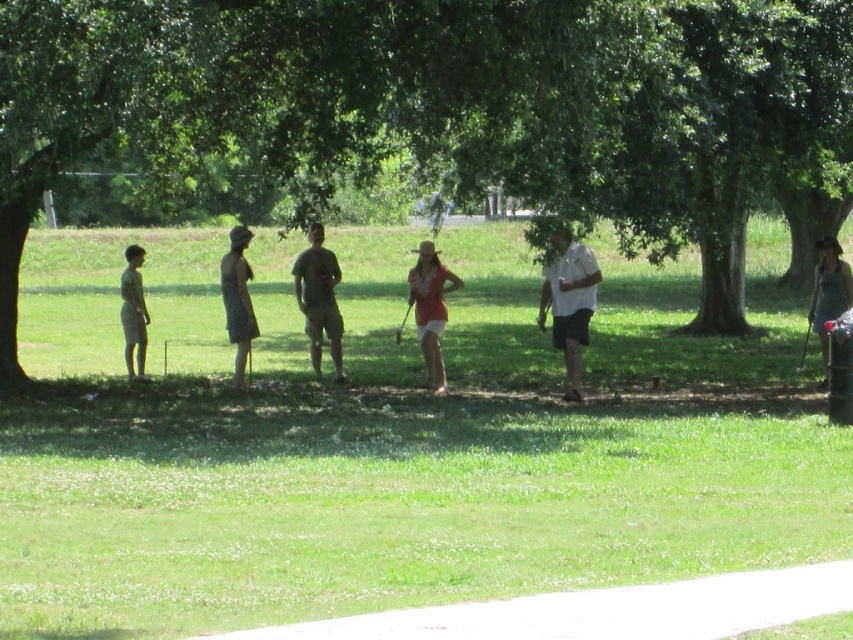
You are a photographer trying to capture a photo of the pink fabric dress at center and the green grass at center. Based on their positions, which object is located to the left?

The pink fabric dress at center is located to the left of the green grass at center.

In the scene shown: You are standing in the park and want to take a photo of the denim dress at right without the green leafy tree at center blocking it. How should you position yourself?

Move behind the denim dress at right so that it is between you and the green leafy tree at center. Since the green leafy tree at center is in front of the denim dress at right, positioning yourself behind the denim dress will place the tree behind the dress, thus avoiding obstruction.